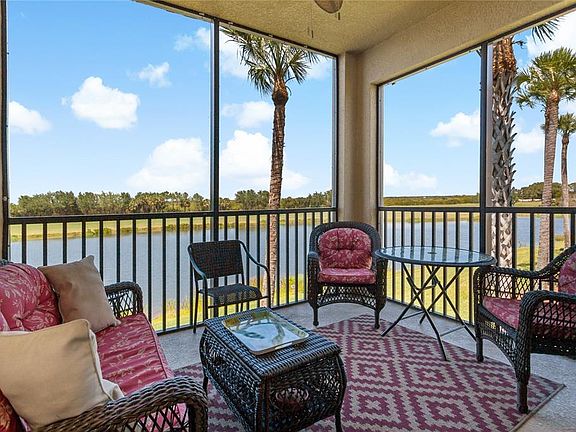
I want to click on tray, so click(x=264, y=333).